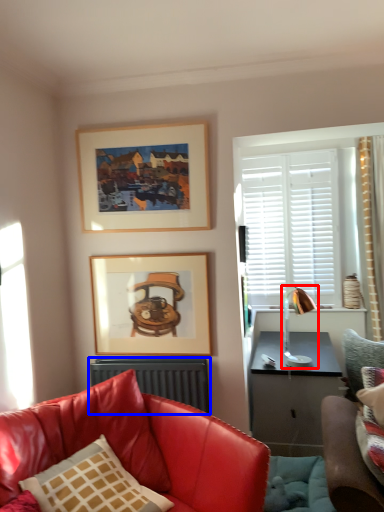
Question: Which object is further to the camera taking this photo, lamp (highlighted by a red box) or radiator (highlighted by a blue box)?

Choices:
 (A) lamp
 (B) radiator

Answer: (A)